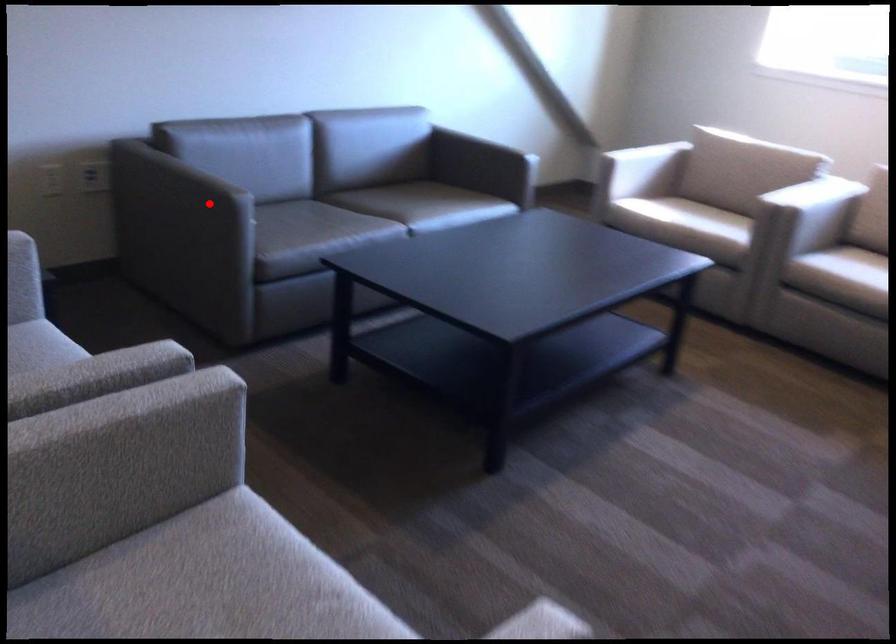
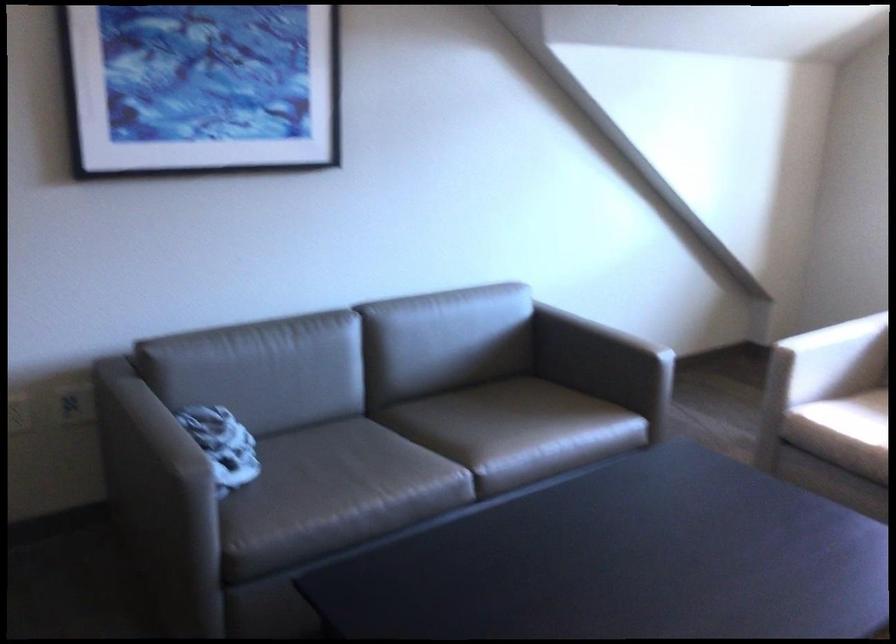
The point at the highlighted location is marked in the first image. Where is the corresponding point in the second image?

(158, 491)